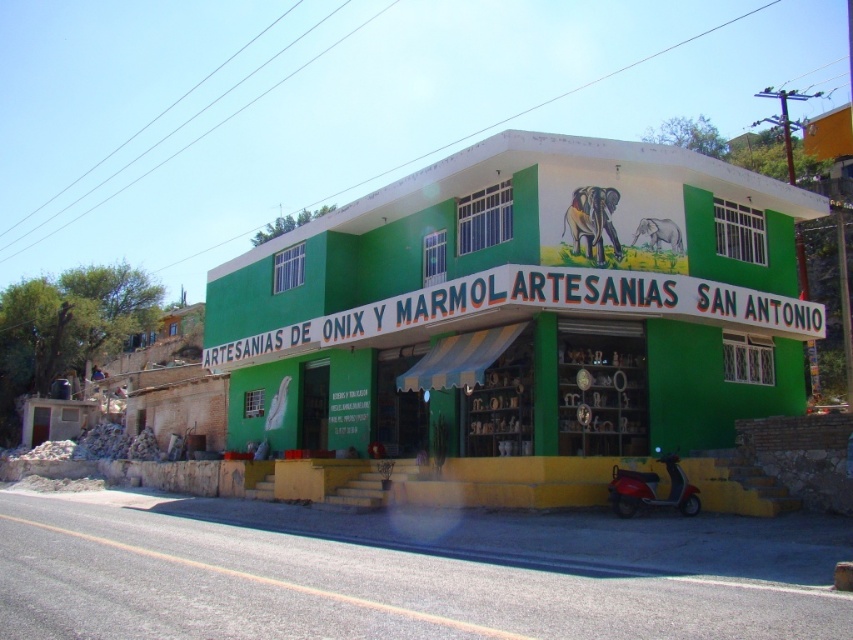
Question: Does green matte building at center appear over metallic red scooter at lower right?

Choices:
 (A) yes
 (B) no

Answer: (A)

Question: Can you confirm if green matte building at center is smaller than metallic red scooter at lower right?

Choices:
 (A) no
 (B) yes

Answer: (A)

Question: Can you confirm if green matte building at center is bigger than metallic red scooter at lower right?

Choices:
 (A) no
 (B) yes

Answer: (B)